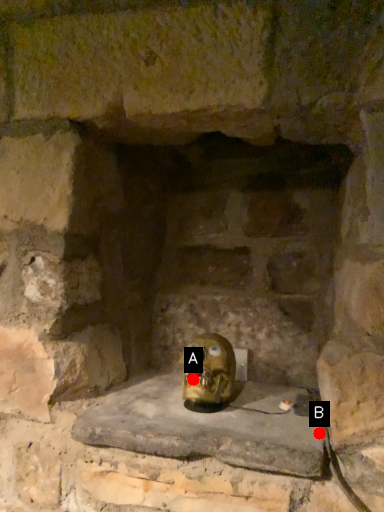
Question: Two points are circled on the image, labeled by A and B beside each circle. Which point is farther from the camera taking this photo?

Choices:
 (A) A is further
 (B) B is further

Answer: (A)